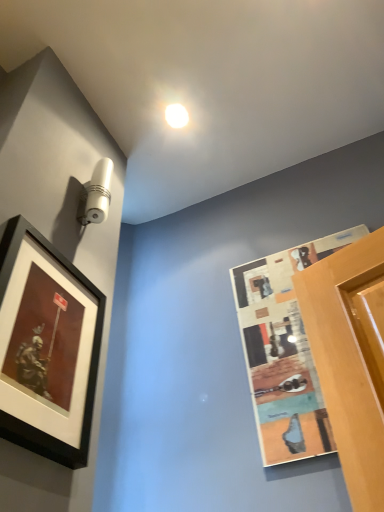
Question: Is wooden textured picture frame at right, which is the second picture frame in left-to-right order, further to camera compared to white glossy droplight at upper center?

Choices:
 (A) no
 (B) yes

Answer: (A)

Question: Does wooden textured picture frame at right, acting as the 1th picture frame starting from the right, have a lesser height compared to white glossy droplight at upper center?

Choices:
 (A) yes
 (B) no

Answer: (B)

Question: Is white glossy droplight at upper center located within wooden textured picture frame at right, which is the second picture frame in left-to-right order?

Choices:
 (A) no
 (B) yes

Answer: (A)

Question: Is wooden textured picture frame at right, which is the second picture frame in left-to-right order, outside white glossy droplight at upper center?

Choices:
 (A) yes
 (B) no

Answer: (A)

Question: Considering the relative sizes of wooden textured picture frame at right, acting as the 1th picture frame starting from the right, and white glossy droplight at upper center in the image provided, is wooden textured picture frame at right, acting as the 1th picture frame starting from the right, bigger than white glossy droplight at upper center?

Choices:
 (A) yes
 (B) no

Answer: (A)

Question: Is wooden textured picture frame at right, which is the second picture frame in left-to-right order, oriented away from white glossy droplight at upper center?

Choices:
 (A) yes
 (B) no

Answer: (B)

Question: Is matte black picture frame at left, acting as the 2th picture frame starting from the right, to the right of wooden textured picture frame at right, acting as the 1th picture frame starting from the right, from the viewer's perspective?

Choices:
 (A) no
 (B) yes

Answer: (A)

Question: Is matte black picture frame at left, acting as the 2th picture frame starting from the right, outside wooden textured picture frame at right, which is the second picture frame in left-to-right order?

Choices:
 (A) no
 (B) yes

Answer: (B)

Question: Are matte black picture frame at left, acting as the 2th picture frame starting from the right, and wooden textured picture frame at right, acting as the 1th picture frame starting from the right, beside each other?

Choices:
 (A) yes
 (B) no

Answer: (B)

Question: From a real-world perspective, does matte black picture frame at left, which is the first picture frame from left to right, stand above wooden textured picture frame at right, which is the second picture frame in left-to-right order?

Choices:
 (A) yes
 (B) no

Answer: (B)

Question: From the image's perspective, does matte black picture frame at left, which is the first picture frame from left to right, appear lower than wooden textured picture frame at right, acting as the 1th picture frame starting from the right?

Choices:
 (A) no
 (B) yes

Answer: (A)

Question: Considering the relative sizes of matte black picture frame at left, which is the first picture frame from left to right, and wooden textured picture frame at right, acting as the 1th picture frame starting from the right, in the image provided, is matte black picture frame at left, which is the first picture frame from left to right, smaller than wooden textured picture frame at right, acting as the 1th picture frame starting from the right,?

Choices:
 (A) no
 (B) yes

Answer: (B)

Question: Could you tell me if wooden textured picture frame at right, acting as the 1th picture frame starting from the right, is facing matte black picture frame at left, which is the first picture frame from left to right?

Choices:
 (A) no
 (B) yes

Answer: (A)